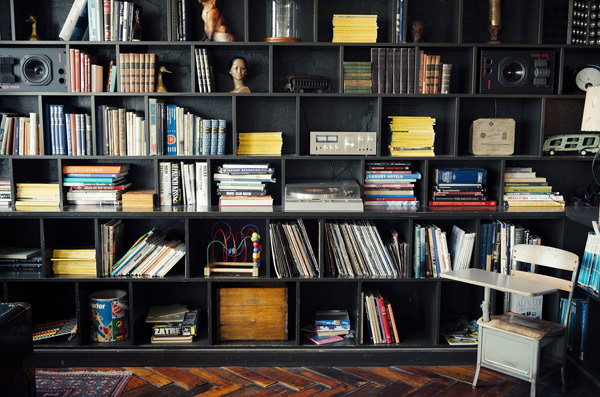
Image resolution: width=600 pixels, height=397 pixels. Find the location of `stacks of yellow books`. stacks of yellow books is located at coordinates (348, 32), (408, 135), (254, 143), (68, 258).